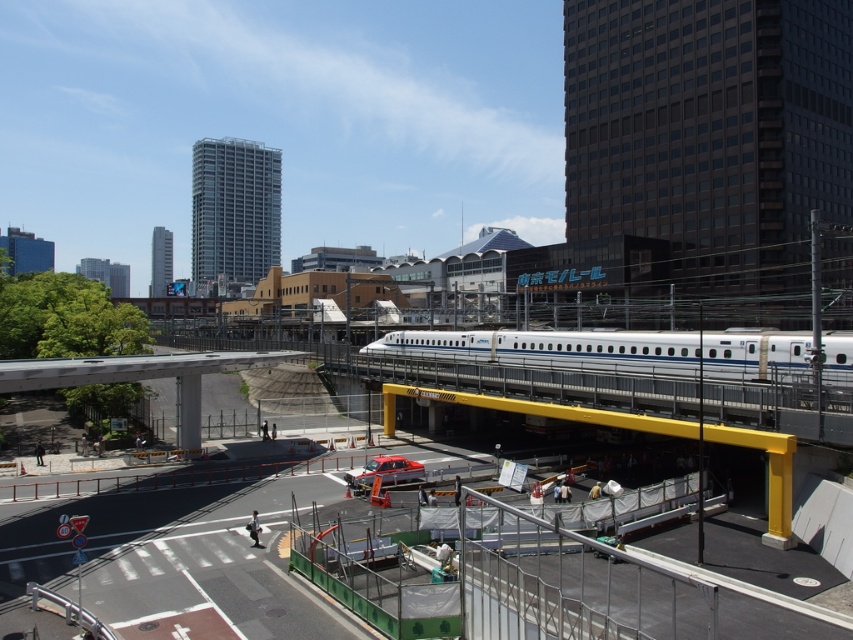
You are a pedestrian standing at the construction site below the elevated track. You want to cross the road to reach the station entrance. There is a white glossy passenger train at center and a metallic silver car at center in your view. Which object is closer to you?

The metallic silver car at center is closer to you because the white glossy passenger train at center is located above it, meaning the car is below at ground level while the train is elevated.

You are standing at the point marked by coordinates point(554,349) in the urban scene. What object is located exactly at this point?

The point(554,349) is exactly where the white glossy passenger train at center is located.